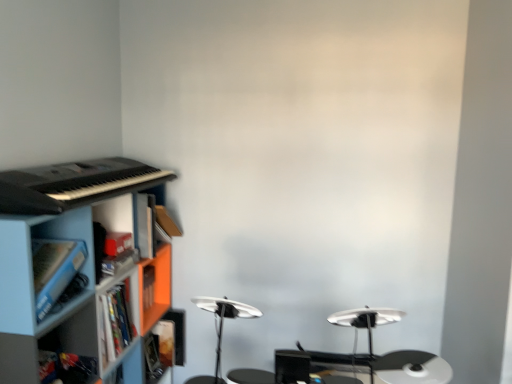
Measure the distance between blue plastic shelf at lower left and camera.

blue plastic shelf at lower left is 3.94 feet away from camera.

Describe the element at coordinates (160, 351) in the screenshot. I see `hardcover book at lower left` at that location.

Measure the distance between point (x=134, y=239) and camera.

Point (x=134, y=239) and camera are 6.34 feet apart.

Find the location of a particular element. Image resolution: width=512 pixels, height=384 pixels. blue plastic cabinet at lower left, which is the second cabinet from back to front is located at coordinates (31, 262).

Consider the image. Considering their positions, is blue plastic cabinet at lower left, which ranks as the 1th cabinet in front-to-back order, located in front of or behind blue plastic shelf at lower left?

Visually, blue plastic cabinet at lower left, which ranks as the 1th cabinet in front-to-back order, is located behind blue plastic shelf at lower left.

Is point (10, 316) closer to camera compared to point (149, 323)?

Yes, point (10, 316) is in front of point (149, 323).

Is blue plastic cabinet at lower left, which ranks as the 1th cabinet in front-to-back order, oriented towards blue plastic shelf at lower left?

Yes, blue plastic cabinet at lower left, which ranks as the 1th cabinet in front-to-back order, is turned towards blue plastic shelf at lower left.

Can you confirm if blue plastic cabinet at lower left, which ranks as the 1th cabinet in front-to-back order, is positioned to the right of blue plastic shelf at lower left?

No, blue plastic cabinet at lower left, which ranks as the 1th cabinet in front-to-back order, is not to the right of blue plastic shelf at lower left.

From the image's perspective, is blue plastic cabinet at lower left, which is the second cabinet from back to front, positioned above or below orange matte cabinet at left, the first cabinet positioned from the back?

From the image's perspective, blue plastic cabinet at lower left, which is the second cabinet from back to front, appears below orange matte cabinet at left, the first cabinet positioned from the back.

Measure the distance from blue plastic cabinet at lower left, which ranks as the 1th cabinet in front-to-back order, to orange matte cabinet at left, the 2th cabinet when ordered from front to back.

They are 14.32 inches apart.

The image size is (512, 384). In order to click on cabinet that is in front of the orange matte cabinet at left, the first cabinet positioned from the back in this screenshot , I will do `click(31, 262)`.

In the scene shown: Would you say blue plastic cabinet at lower left, which is the second cabinet from back to front, is outside orange matte cabinet at left, the first cabinet positioned from the back?

Yes, blue plastic cabinet at lower left, which is the second cabinet from back to front, is located beyond the bounds of orange matte cabinet at left, the first cabinet positioned from the back.

Is blue plastic cabinet at lower left, which is the second cabinet from back to front, positioned with its back to hardcover book at lower left?

blue plastic cabinet at lower left, which is the second cabinet from back to front, is not turned away from hardcover book at lower left.

The height and width of the screenshot is (384, 512). Identify the location of book on the right side of blue plastic cabinet at lower left, which ranks as the 1th cabinet in front-to-back order. (160, 351).

Who is more distant, blue plastic cabinet at lower left, which ranks as the 1th cabinet in front-to-back order, or hardcover book at lower left?

hardcover book at lower left.

How many degrees apart are the facing directions of orange matte cabinet at left, the 2th cabinet when ordered from front to back, and blue plastic shelf at lower left?

1.74 degrees.

Which is behind, point (127, 219) or point (91, 302)?

The point (127, 219) is farther from the camera.

In terms of size, does orange matte cabinet at left, the 2th cabinet when ordered from front to back, appear bigger or smaller than blue plastic shelf at lower left?

Considering their sizes, orange matte cabinet at left, the 2th cabinet when ordered from front to back, takes up less space than blue plastic shelf at lower left.

From the image's perspective, would you say orange matte cabinet at left, the first cabinet positioned from the back, is positioned over blue plastic shelf at lower left?

Yes, from the image's perspective, orange matte cabinet at left, the first cabinet positioned from the back, is above blue plastic shelf at lower left.

From a real-world perspective, who is located higher, hardcover book at lower left or orange matte cabinet at left, the first cabinet positioned from the back?

orange matte cabinet at left, the first cabinet positioned from the back.

Is hardcover book at lower left with orange matte cabinet at left, the first cabinet positioned from the back?

No, hardcover book at lower left is not in contact with orange matte cabinet at left, the first cabinet positioned from the back.

Can you confirm if hardcover book at lower left is wider than orange matte cabinet at left, the 2th cabinet when ordered from front to back?

Correct, the width of hardcover book at lower left exceeds that of orange matte cabinet at left, the 2th cabinet when ordered from front to back.

Who is shorter, hardcover book at lower left or orange matte cabinet at left, the 2th cabinet when ordered from front to back?

orange matte cabinet at left, the 2th cabinet when ordered from front to back.

Which of these two, hardcover book at lower left or blue plastic shelf at lower left, is thinner?

With smaller width is hardcover book at lower left.

Is hardcover book at lower left positioned before blue plastic shelf at lower left?

That is False.

This screenshot has width=512, height=384. Identify the location of book that appears below the blue plastic shelf at lower left (from a real-world perspective). (160, 351).

Is hardcover book at lower left looking in the opposite direction of blue plastic shelf at lower left?

Yes.

Is orange matte cabinet at left, the first cabinet positioned from the back, to the right of blue plastic cabinet at lower left, which ranks as the 1th cabinet in front-to-back order, from the viewer's perspective?

Yes, orange matte cabinet at left, the first cabinet positioned from the back, is to the right of blue plastic cabinet at lower left, which ranks as the 1th cabinet in front-to-back order.

In terms of width, does orange matte cabinet at left, the 2th cabinet when ordered from front to back, look wider or thinner when compared to blue plastic cabinet at lower left, which is the second cabinet from back to front?

Clearly, orange matte cabinet at left, the 2th cabinet when ordered from front to back, has less width compared to blue plastic cabinet at lower left, which is the second cabinet from back to front.

From a real-world perspective, is orange matte cabinet at left, the 2th cabinet when ordered from front to back, physically located above or below blue plastic cabinet at lower left, which is the second cabinet from back to front?

From a real-world perspective, orange matte cabinet at left, the 2th cabinet when ordered from front to back, is physically below blue plastic cabinet at lower left, which is the second cabinet from back to front.

From their relative heights in the image, would you say orange matte cabinet at left, the first cabinet positioned from the back, is taller or shorter than blue plastic cabinet at lower left, which is the second cabinet from back to front?

orange matte cabinet at left, the first cabinet positioned from the back, is shorter than blue plastic cabinet at lower left, which is the second cabinet from back to front.

Find the location of a particular element. The width and height of the screenshot is (512, 384). shelf on the right of blue plastic cabinet at lower left, which ranks as the 1th cabinet in front-to-back order is located at coordinates (77, 294).

Where is `cabinet located underneath the blue plastic cabinet at lower left, which is the second cabinet from back to front (from a real-world perspective)`? This screenshot has height=384, width=512. cabinet located underneath the blue plastic cabinet at lower left, which is the second cabinet from back to front (from a real-world perspective) is located at coordinates (x=117, y=214).

Based on their spatial positions, is blue plastic shelf at lower left or hardcover book at lower left further from orange matte cabinet at left, the first cabinet positioned from the back?

Among the two, hardcover book at lower left is located further to orange matte cabinet at left, the first cabinet positioned from the back.

Estimate the real-world distances between objects in this image. Which object is closer to hardcover book at lower left, orange matte cabinet at left, the 2th cabinet when ordered from front to back, or blue plastic shelf at lower left?

Among the two, blue plastic shelf at lower left is located nearer to hardcover book at lower left.

From the image, which object appears to be nearer to blue plastic shelf at lower left, orange matte cabinet at left, the 2th cabinet when ordered from front to back, or blue plastic cabinet at lower left, which ranks as the 1th cabinet in front-to-back order?

blue plastic cabinet at lower left, which ranks as the 1th cabinet in front-to-back order, is closer to blue plastic shelf at lower left.

In the scene shown: Estimate the real-world distances between objects in this image. Which object is further from orange matte cabinet at left, the 2th cabinet when ordered from front to back, blue plastic cabinet at lower left, which is the second cabinet from back to front, or blue plastic shelf at lower left?

blue plastic cabinet at lower left, which is the second cabinet from back to front.

Which object lies further to the anchor point blue plastic shelf at lower left, hardcover book at lower left or orange matte cabinet at left, the 2th cabinet when ordered from front to back?

The object further to blue plastic shelf at lower left is hardcover book at lower left.

When comparing their distances from blue plastic shelf at lower left, does hardcover book at lower left or blue plastic cabinet at lower left, which is the second cabinet from back to front, seem closer?

blue plastic cabinet at lower left, which is the second cabinet from back to front, is closer to blue plastic shelf at lower left.

Which object lies further to the anchor point hardcover book at lower left, blue plastic shelf at lower left or blue plastic cabinet at lower left, which is the second cabinet from back to front?

blue plastic cabinet at lower left, which is the second cabinet from back to front, is further to hardcover book at lower left.

Estimate the real-world distances between objects in this image. Which object is further from hardcover book at lower left, blue plastic cabinet at lower left, which is the second cabinet from back to front, or blue plastic shelf at lower left?

Based on the image, blue plastic cabinet at lower left, which is the second cabinet from back to front, appears to be further to hardcover book at lower left.

This screenshot has height=384, width=512. I want to click on cabinet between blue plastic cabinet at lower left, which is the second cabinet from back to front, and hardcover book at lower left from front to back, so click(117, 214).

Find the location of a particular element. This screenshot has height=384, width=512. cabinet between blue plastic shelf at lower left and orange matte cabinet at left, the first cabinet positioned from the back, in the front-back direction is located at coordinates (31, 262).